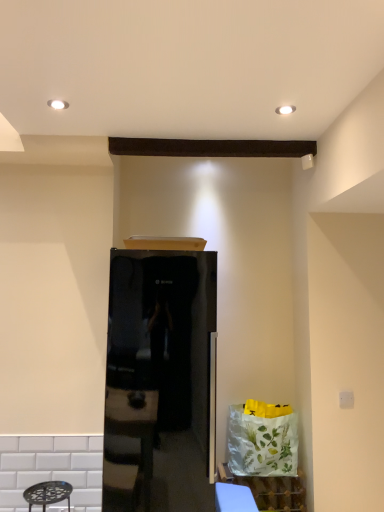
Question: Is blue fabric table at lower center aimed at white glossy cabinet at lower right?

Choices:
 (A) no
 (B) yes

Answer: (A)

Question: From a real-world perspective, is blue fabric table at lower center beneath white glossy cabinet at lower right?

Choices:
 (A) no
 (B) yes

Answer: (A)

Question: Is blue fabric table at lower center not within white glossy cabinet at lower right?

Choices:
 (A) no
 (B) yes

Answer: (B)

Question: Is blue fabric table at lower center wider than white glossy cabinet at lower right?

Choices:
 (A) no
 (B) yes

Answer: (B)

Question: Is blue fabric table at lower center taller than white glossy cabinet at lower right?

Choices:
 (A) no
 (B) yes

Answer: (A)

Question: Considering the positions of blue fabric table at lower center and white glossy cabinet at lower right in the image, is blue fabric table at lower center bigger or smaller than white glossy cabinet at lower right?

Choices:
 (A) small
 (B) big

Answer: (A)

Question: From a real-world perspective, is blue fabric table at lower center above or below white glossy cabinet at lower right?

Choices:
 (A) below
 (B) above

Answer: (B)

Question: Considering the relative positions of blue fabric table at lower center and white glossy cabinet at lower right in the image provided, is blue fabric table at lower center to the left or to the right of white glossy cabinet at lower right?

Choices:
 (A) left
 (B) right

Answer: (A)

Question: Choose the correct answer: Is blue fabric table at lower center inside white glossy cabinet at lower right or outside it?

Choices:
 (A) outside
 (B) inside

Answer: (A)

Question: Is glossy black refrigerator at center to the left or to the right of blue fabric table at lower center in the image?

Choices:
 (A) right
 (B) left

Answer: (B)

Question: In terms of width, does glossy black refrigerator at center look wider or thinner when compared to blue fabric table at lower center?

Choices:
 (A) wide
 (B) thin

Answer: (A)

Question: Is point pos(192,358) positioned closer to the camera than point pos(244,494)?

Choices:
 (A) closer
 (B) farther

Answer: (A)

Question: From a real-world perspective, relative to blue fabric table at lower center, is glossy black refrigerator at center vertically above or below?

Choices:
 (A) below
 (B) above

Answer: (B)

Question: In terms of height, does white glossy cabinet at lower right look taller or shorter compared to glossy black refrigerator at center?

Choices:
 (A) tall
 (B) short

Answer: (B)

Question: In terms of width, does white glossy cabinet at lower right look wider or thinner when compared to glossy black refrigerator at center?

Choices:
 (A) wide
 (B) thin

Answer: (B)